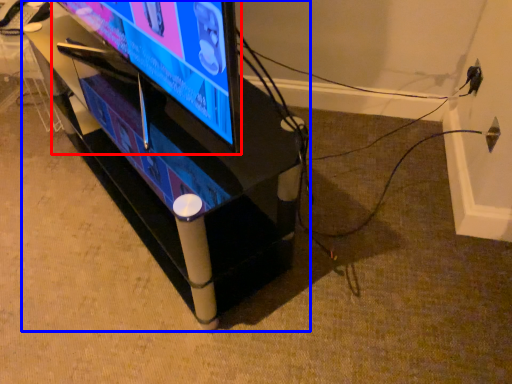
Question: Among these objects, which one is farthest to the camera, television (highlighted by a red box) or furniture (highlighted by a blue box)?

Choices:
 (A) television
 (B) furniture

Answer: (B)